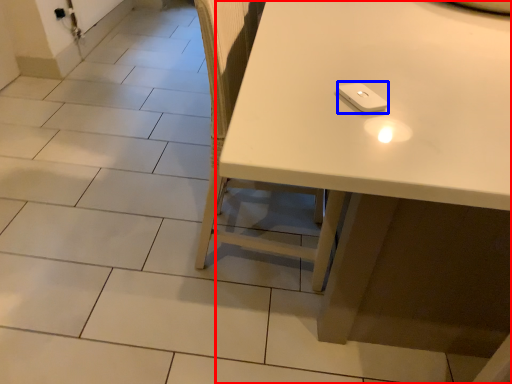
Question: Among these objects, which one is farthest to the camera, table (highlighted by a red box) or Wii controller (highlighted by a blue box)?

Choices:
 (A) table
 (B) Wii controller

Answer: (B)